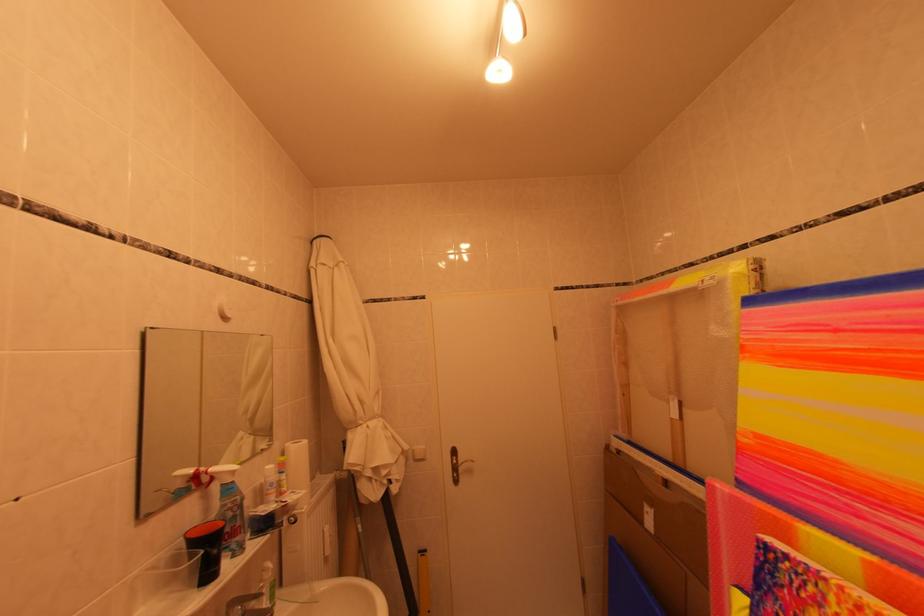
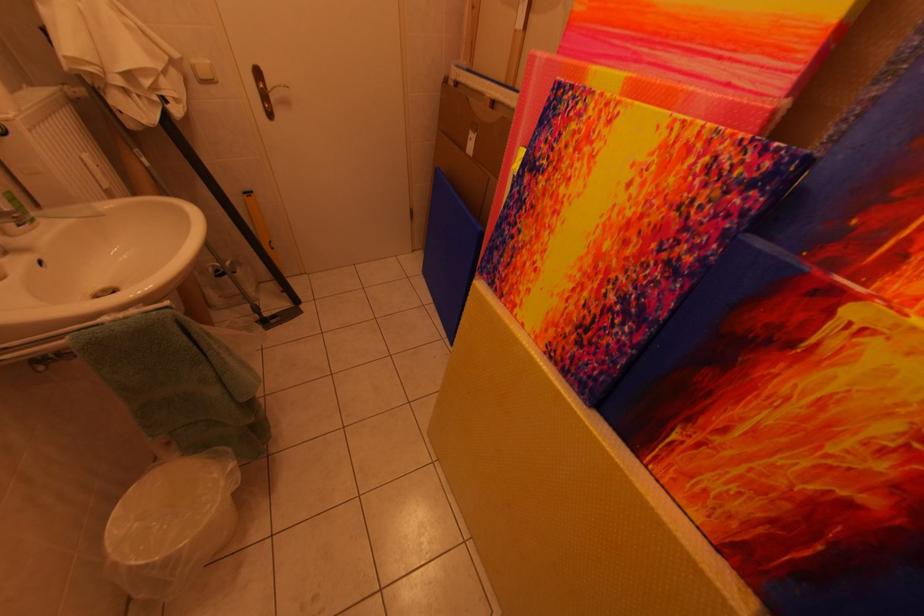
Find the pixel in the second image that matches [424,451] in the first image.

(203, 65)